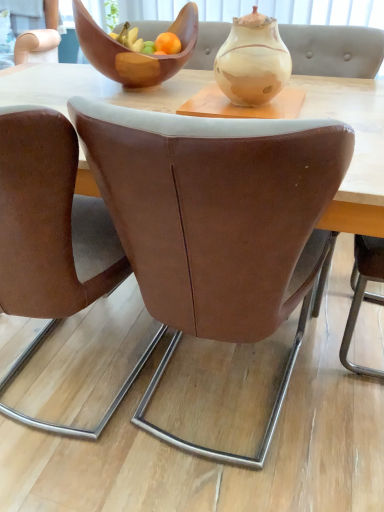
Image resolution: width=384 pixels, height=512 pixels. I want to click on vacant area to the right of marbled ceramic vase at center, so click(x=337, y=104).